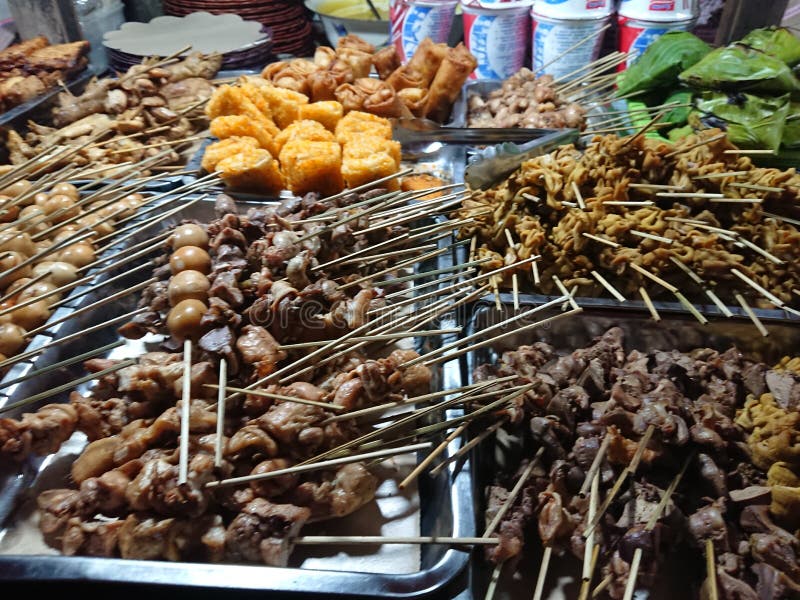
Identify the location of table. (294, 29).